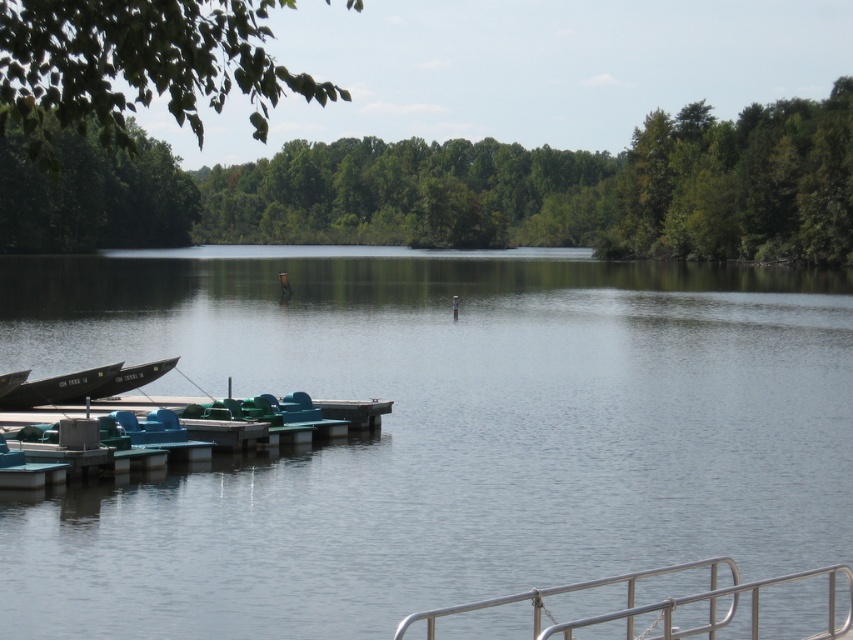
You are standing on the dock and want to reach the silver metallic railing at lower right. Which direction should you move to get there from the clear water at center?

→ The silver metallic railing at lower right is to the right of the clear water at center, so you should move to the right to reach it.

You are standing on the dock and want to know what is located exactly at the coordinates point (x=434, y=433). What would you find there?

At point (x=434, y=433) lies clear water at center.

You are a photographer planning to capture the serene lakeside scene. You have a camera with a wide angle lens that can capture large areas. Which object between the clear water at center and the silver metallic railing at lower right would be better suited for showcasing the vastness of the scene?

The clear water at center is larger in size than the silver metallic railing at lower right, making it better suited to showcase the vastness of the scene.